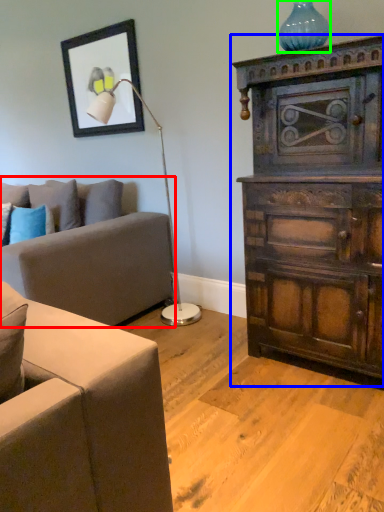
Question: Considering the real-world distances, which object is farthest from studio couch (highlighted by a red box)? chest of drawers (highlighted by a blue box) or vase (highlighted by a green box)?

Choices:
 (A) chest of drawers
 (B) vase

Answer: (B)